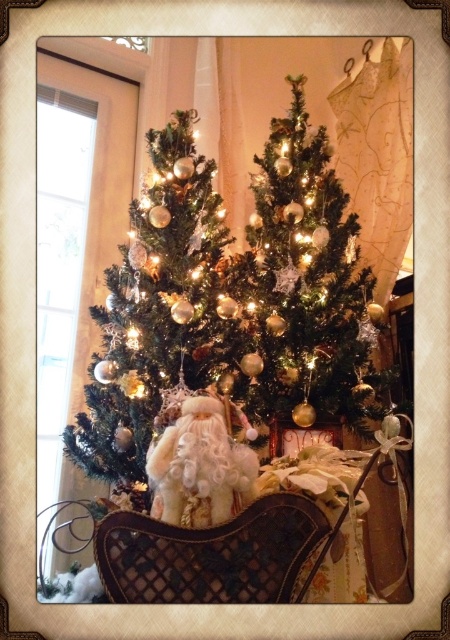
Measure the distance between shiny gold ornaments at center and white fluffy santa at center.

38.29 centimeters

Between shiny gold ornaments at center and white fluffy santa at center, which one is positioned lower?

white fluffy santa at center

Identify the location of shiny gold ornaments at center. The height and width of the screenshot is (640, 450). (304, 288).

Find the location of `shiny gold ornaments at center`. shiny gold ornaments at center is located at coordinates (304, 288).

Based on the photo, between shiny gold ornaments at left and shiny gold ornaments at center, which one is positioned higher?

shiny gold ornaments at center

Can you confirm if shiny gold ornaments at left is positioned to the left of shiny gold ornaments at center?

Correct, you'll find shiny gold ornaments at left to the left of shiny gold ornaments at center.

The height and width of the screenshot is (640, 450). I want to click on shiny gold ornaments at left, so click(x=161, y=339).

Does shiny gold ornaments at left have a greater height compared to white fluffy santa at center?

Yes, shiny gold ornaments at left is taller than white fluffy santa at center.

Who is positioned more to the right, shiny gold ornaments at left or white fluffy santa at center?

white fluffy santa at center is more to the right.

I want to click on shiny gold ornaments at left, so click(x=161, y=339).